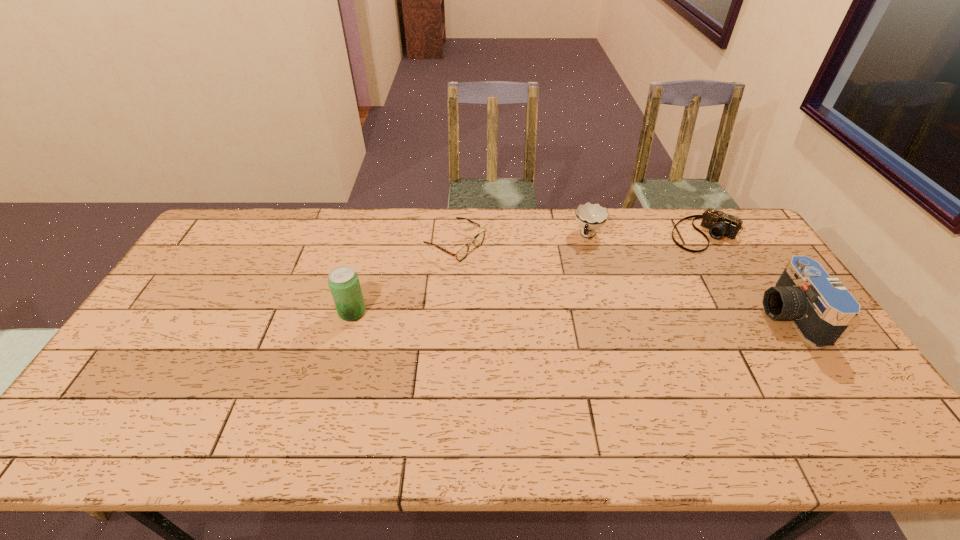
Identify the location of vacant area that lies between the shorter camera and the spectacles. The image size is (960, 540). (580, 239).

Image resolution: width=960 pixels, height=540 pixels. Identify the location of object that stands as the third closest to the cup. (821, 308).

This screenshot has height=540, width=960. In order to click on object that is the fourth closest to the second shortest object in this screenshot , I will do `click(343, 281)`.

Identify the location of vacant point that satisfies the following two spatial constraints: 1. on the front side of the spectacles; 2. on the front-facing side of the nearer camera. (451, 315).

This screenshot has height=540, width=960. In order to click on vacant space that satisfies the following two spatial constraints: 1. on the front side of the soda; 2. on the front-facing side of the nearer camera in this screenshot , I will do `click(351, 315)`.